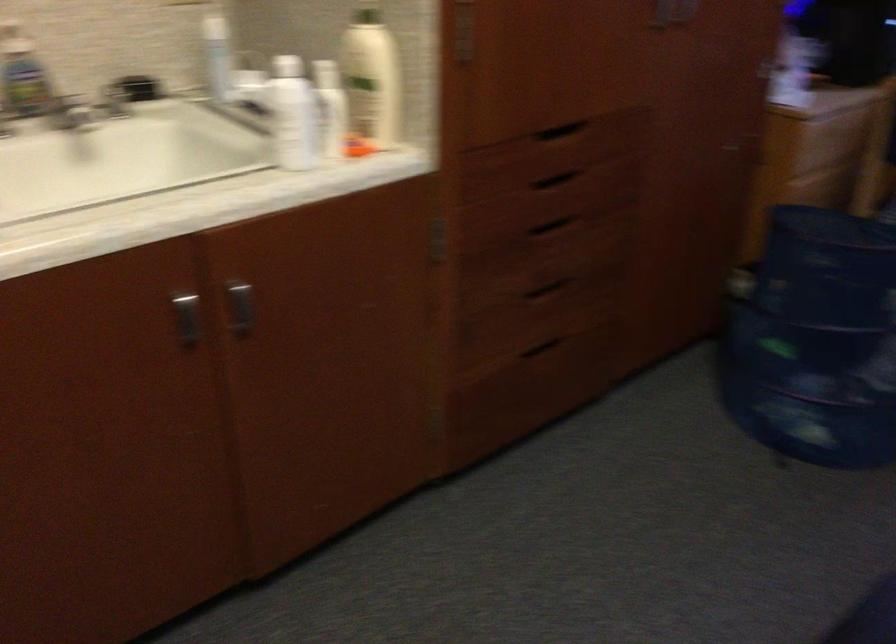
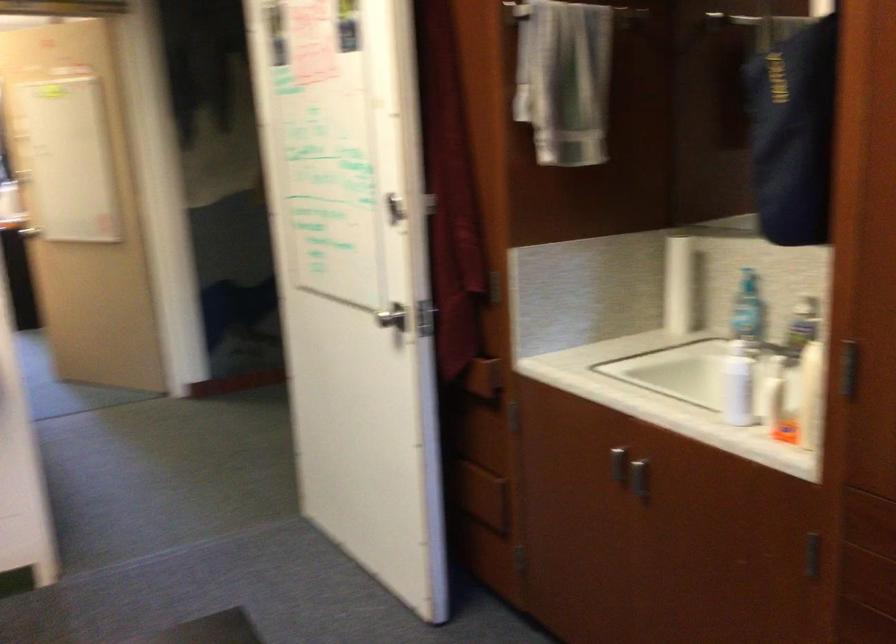
The point at (309,116) is marked in the first image. Where is the corresponding point in the second image?

(737, 384)